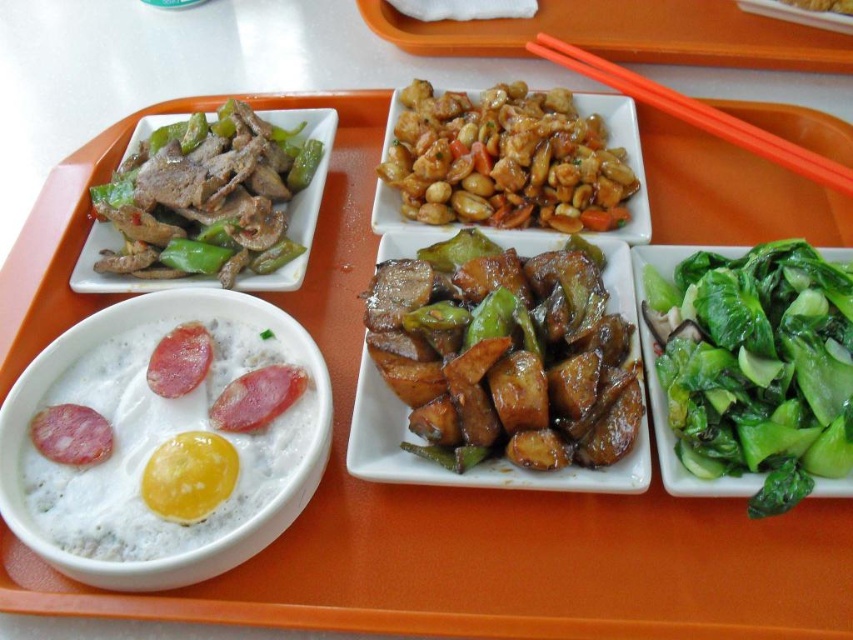
The height and width of the screenshot is (640, 853). What do you see at coordinates (512, 161) in the screenshot?
I see `brown glossy peanuts at center` at bounding box center [512, 161].

Is point (422, 186) closer to camera compared to point (573, 36)?

That is True.

Is point (561, 202) more distant than point (590, 48)?

No, (561, 202) is closer to viewer.

Find the location of `brown glossy peanuts at center`. brown glossy peanuts at center is located at coordinates (512, 161).

Does green leafy vegetables at lower right come behind shiny brown eggplant at center?

No, green leafy vegetables at lower right is closer to the viewer.

Which is more to the left, green leafy vegetables at lower right or shiny brown eggplant at center?

shiny brown eggplant at center

Who is more forward, (711, 288) or (434, 298)?

Point (711, 288)

At what (x,y) coordinates should I click in order to perform the action: click on green leafy vegetables at lower right. Please return your answer as a coordinate pair (x, y). The image size is (853, 640). Looking at the image, I should click on (751, 371).

Who is lower down, green leafy vegetables at lower right or shiny plastic chopsticks at upper right?

green leafy vegetables at lower right

Does point (798, 417) come behind point (592, 29)?

No, it is in front of (592, 29).

Does point (849, 460) come farther from viewer compared to point (590, 51)?

No, (849, 460) is in front of (590, 51).

The image size is (853, 640). I want to click on green leafy vegetables at lower right, so click(x=751, y=371).